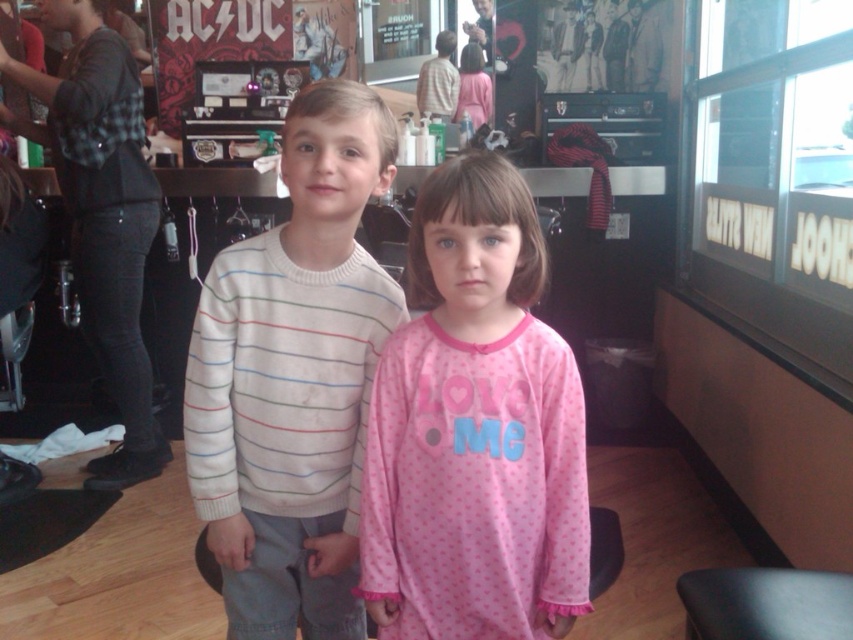
You are a customer in a barbershop and want to choose between the white striped sweater at center and the black flannel shirt at left. Which one is smaller in size?

The white striped sweater at center is smaller than the black flannel shirt at left, so the white striped sweater at center is the smaller one.

You are a photographer standing at the camera position in the barbershop scene. You want to take a photo of the point at coordinates point (405,266). If your camera has a focal length of 50mm, what is the approximate distance in feet between the camera and the point?

The point (405,266) is 7.53 feet away from the camera, so the distance is approximately 7.53 feet.

You are a parent who wants to hand the pink fleece pajamas at center to your child. The child is standing 3.61 feet away from you. Can you reach them without moving?

The pink fleece pajamas at center are 3.61 feet away from you. The average human arm length is about 2.5 feet, so you cannot reach them without moving closer.